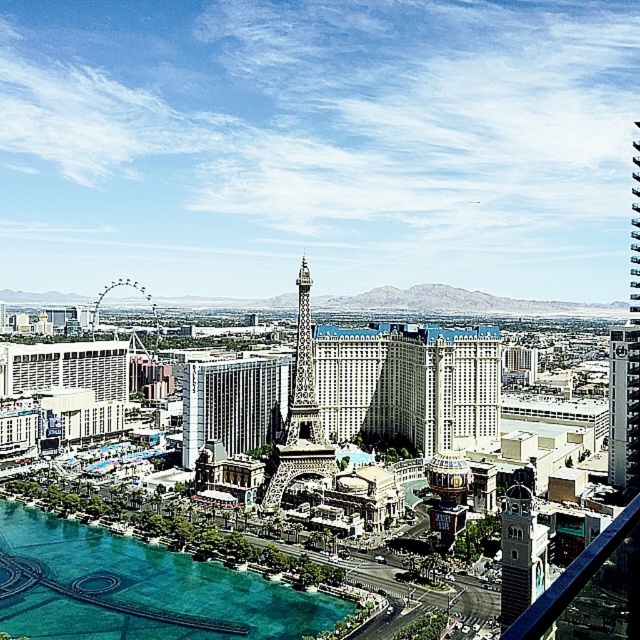
You are a tour guide planning a helicopter tour over the city. The helicopter needs to maintain a minimum altitude of 60 meters to avoid disturbing the landmarks below. Considering the distance between the white glass building at center and the white glossy hotel at center, can the helicopter safely fly between them at the required altitude?

The distance between the white glass building at center and the white glossy hotel at center is 62.91 meters. Since the required minimum altitude is 60 meters, the helicopter can safely fly between them as the distance allows for the necessary clearance.

You are standing at the point closer to the camera between the two points, point [477,326] and point [522,508]. Which point are you standing at?

You are standing at point [477,326] because it is further to the camera than point [522,508].